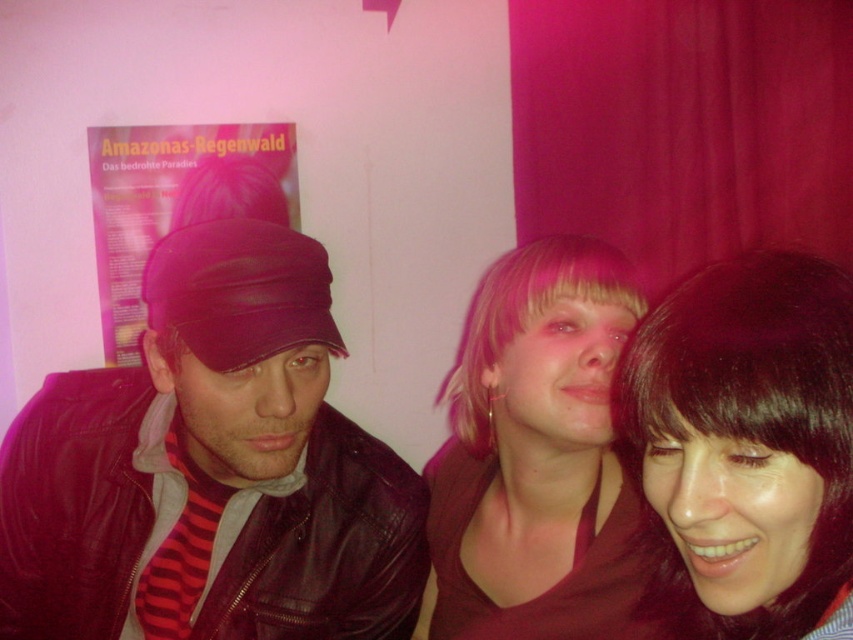
Is leather jacket at left above pink hair at center?

Correct, leather jacket at left is located above pink hair at center.

Looking at this image, is the position of leather jacket at left less distant than that of pink hair at center?

That is True.

Is point (141, 342) positioned in front of point (433, 618)?

No, it is not.

This screenshot has height=640, width=853. I want to click on leather jacket at left, so click(x=210, y=468).

Is matte pink poster at upper left wider than blondehair at center?

Indeed, matte pink poster at upper left has a greater width compared to blondehair at center.

Can you confirm if matte pink poster at upper left is positioned to the left of blondehair at center?

Correct, you'll find matte pink poster at upper left to the left of blondehair at center.

In order to click on matte pink poster at upper left in this screenshot , I will do coord(177,200).

Find the location of a particular element. The width and height of the screenshot is (853, 640). matte pink poster at upper left is located at coordinates (177, 200).

Can you confirm if leather jacket at left is positioned to the left of matte pink poster at upper left?

No, leather jacket at left is not to the left of matte pink poster at upper left.

Can you confirm if leather jacket at left is wider than matte pink poster at upper left?

Correct, the width of leather jacket at left exceeds that of matte pink poster at upper left.

Locate an element on the screen. The image size is (853, 640). leather jacket at left is located at coordinates (210, 468).